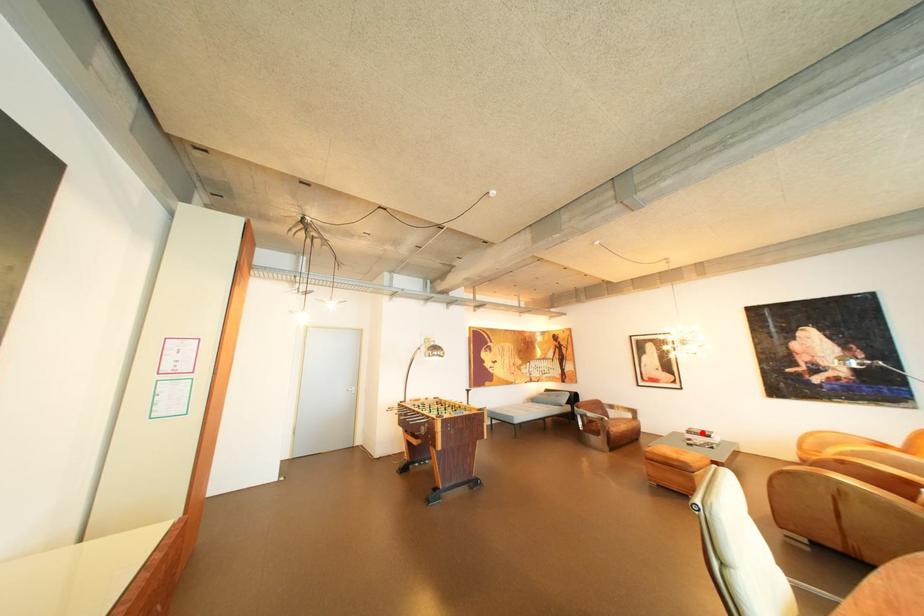
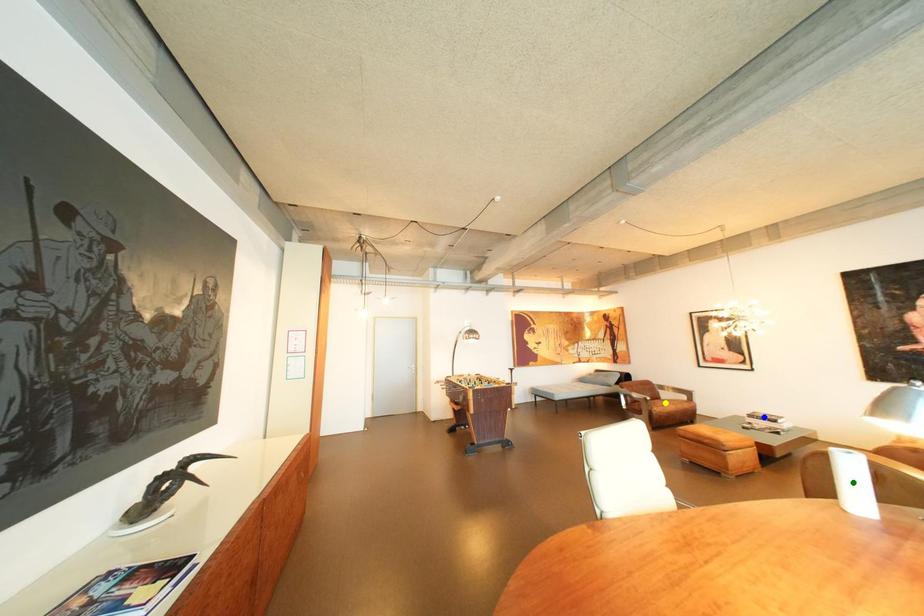
Question: I am providing you with two images of the same scene from different viewpoints. A red point is marked on the first image. You are given multiple points on the second image. In image 2, which mark is for the same physical point as the one in image 1?

Choices:
 (A) green point
 (B) yellow point
 (C) blue point

Answer: (C)